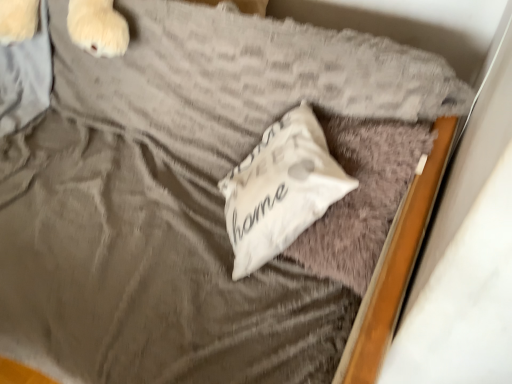
Question: Is white soft pillow at center, arranged as the 1th pillow when viewed from the left, bigger or smaller than white soft pillow at center, which is counted as the second pillow, starting from the left?

Choices:
 (A) small
 (B) big

Answer: (A)

Question: Is white soft pillow at center, arranged as the 2th pillow when viewed from the right, in front of or behind white soft pillow at center, placed as the 1th pillow when sorted from right to left, in the image?

Choices:
 (A) front
 (B) behind

Answer: (B)

Question: From a real-world perspective, relative to white soft pillow at center, placed as the 1th pillow when sorted from right to left, is white soft pillow at center, arranged as the 1th pillow when viewed from the left, vertically above or below?

Choices:
 (A) below
 (B) above

Answer: (B)

Question: From the image's perspective, is white soft pillow at center, which is counted as the second pillow, starting from the left, above or below white soft pillow at center, arranged as the 2th pillow when viewed from the right?

Choices:
 (A) above
 (B) below

Answer: (B)

Question: Is white soft pillow at center, which is counted as the second pillow, starting from the left, in front of or behind white soft pillow at center, arranged as the 2th pillow when viewed from the right, in the image?

Choices:
 (A) front
 (B) behind

Answer: (A)

Question: From a real-world perspective, relative to white soft pillow at center, arranged as the 2th pillow when viewed from the right, is white soft pillow at center, which is counted as the second pillow, starting from the left, vertically above or below?

Choices:
 (A) above
 (B) below

Answer: (B)

Question: Is point (422, 142) closer or farther from the camera than point (305, 221)?

Choices:
 (A) farther
 (B) closer

Answer: (B)